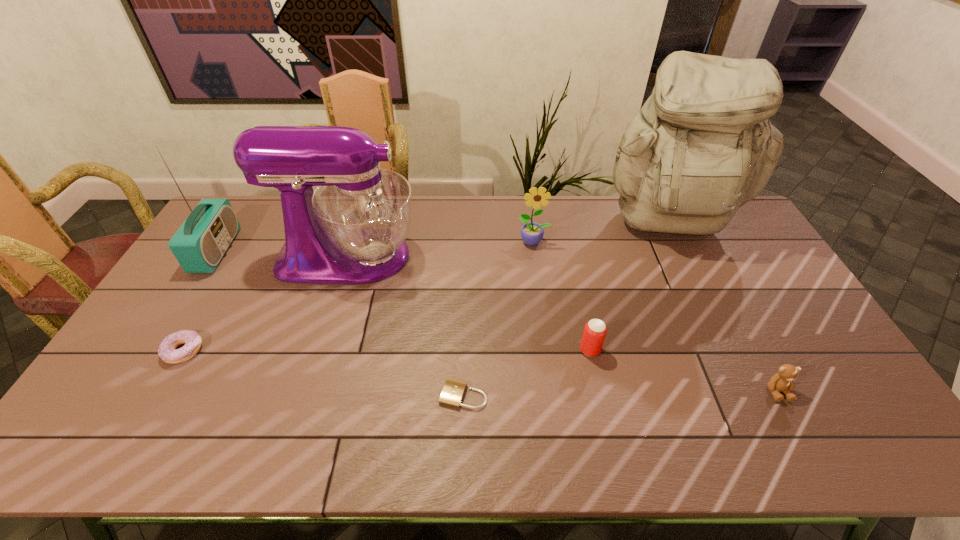
In the image, there is a desktop. At what (x,y) coordinates should I click in order to perform the action: click on vacant region at the near edge. Please return your answer as a coordinate pair (x, y). This screenshot has width=960, height=540. Looking at the image, I should click on 236,430.

In the image, there is a desktop. In order to click on vacant region at the left edge in this screenshot , I will do `click(194, 329)`.

This screenshot has width=960, height=540. In the image, there is a desktop. Find the location of `vacant area at the right edge`. vacant area at the right edge is located at coordinates (725, 265).

At what (x,y) coordinates should I click in order to perform the action: click on free space at the far left corner of the desktop. Please return your answer as a coordinate pair (x, y). Looking at the image, I should click on (235, 210).

At what (x,y) coordinates should I click in order to perform the action: click on free area in between the tallest object and the fifth object from left to right. Please return your answer as a coordinate pair (x, y). The image size is (960, 540). Looking at the image, I should click on (601, 233).

Where is `unoccupied area between the third object from right to left and the sunflower`? The image size is (960, 540). unoccupied area between the third object from right to left and the sunflower is located at coordinates (562, 296).

Image resolution: width=960 pixels, height=540 pixels. In order to click on free area in between the radio receiver and the sixth object from left to right in this screenshot , I will do `click(403, 300)`.

Identify the location of vacant space that's between the sixth object from right to left and the second shortest object. (267, 303).

The height and width of the screenshot is (540, 960). What are the coordinates of `free area in between the backpack and the second tallest object` in the screenshot? It's located at (x=509, y=241).

At what (x,y) coordinates should I click in order to perform the action: click on empty space between the tallest object and the radio receiver. Please return your answer as a coordinate pair (x, y). Looking at the image, I should click on (443, 238).